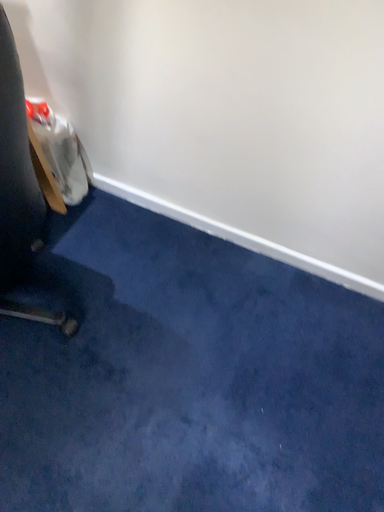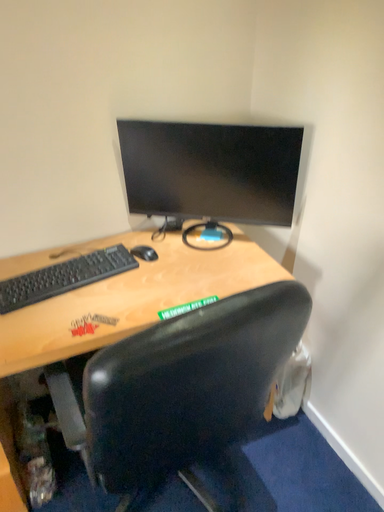
Question: Which way did the camera rotate in the video?

Choices:
 (A) rotated left
 (B) rotated right

Answer: (A)